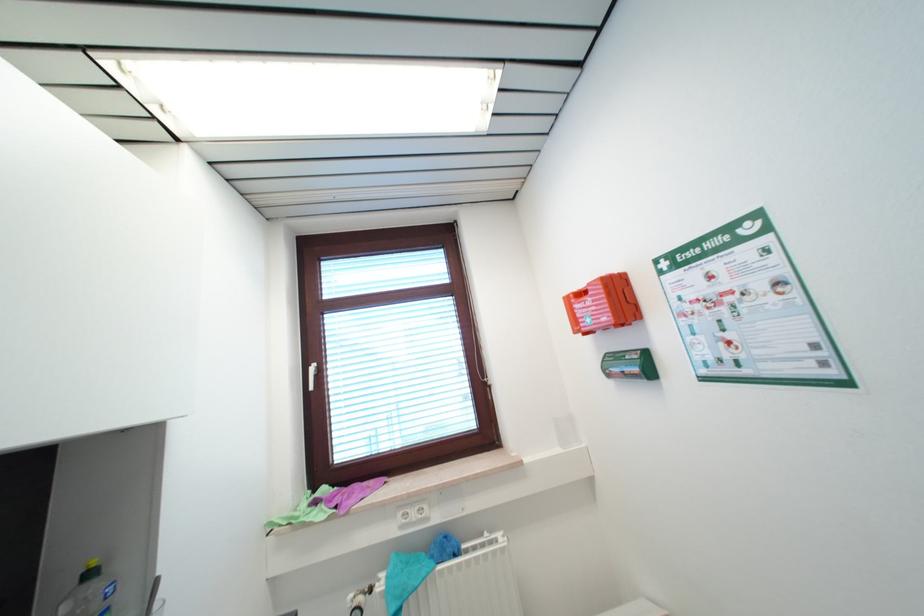
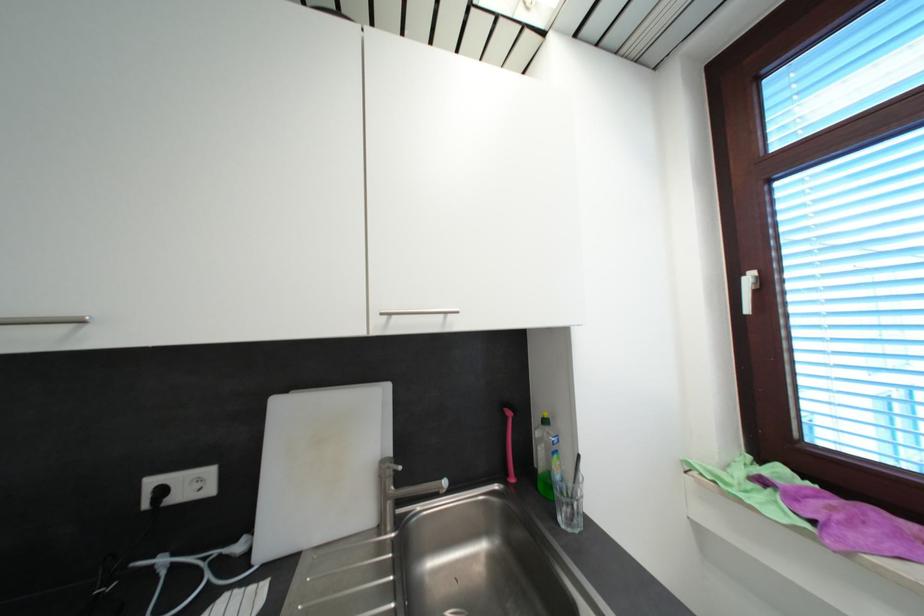
The point at (318,371) is marked in the first image. Where is the corresponding point in the second image?

(754, 281)